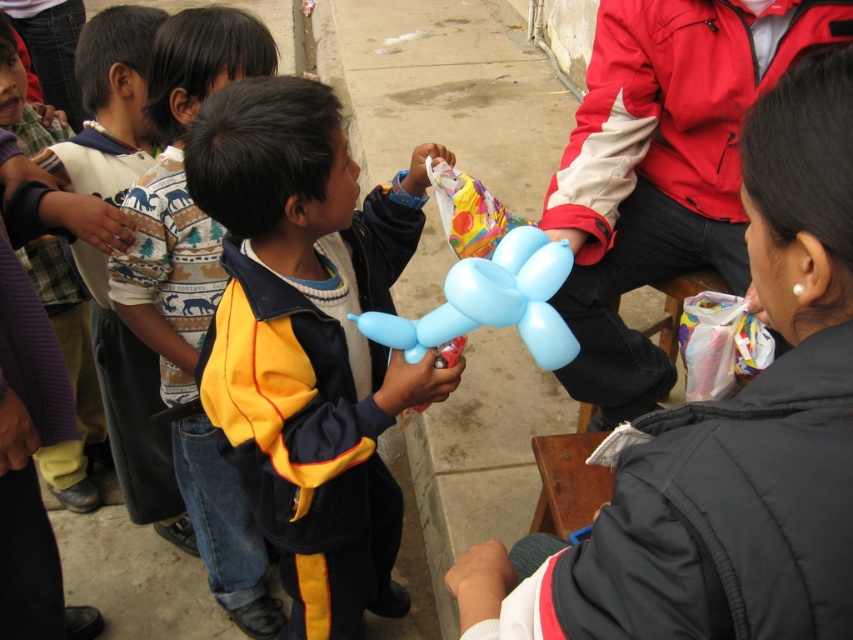
Question: Which object appears farthest from the camera in this image?

Choices:
 (A) matte blue balloon at center
 (B) yellow matte jacket at center

Answer: (B)

Question: Which point is farther to the camera?

Choices:
 (A) matte blue balloon at center
 (B) knitted sweater at left

Answer: (B)

Question: Does yellow matte jacket at center have a lesser width compared to matte blue balloon at center?

Choices:
 (A) yes
 (B) no

Answer: (B)

Question: Is yellow matte jacket at center to the right of matte blue balloon at center from the viewer's perspective?

Choices:
 (A) no
 (B) yes

Answer: (A)

Question: Which point is farther to the camera?

Choices:
 (A) knitted sweater at left
 (B) matte blue balloon at center

Answer: (A)

Question: In this image, where is yellow fabric jacket at left located relative to knitted sweater at left?

Choices:
 (A) right
 (B) left

Answer: (A)